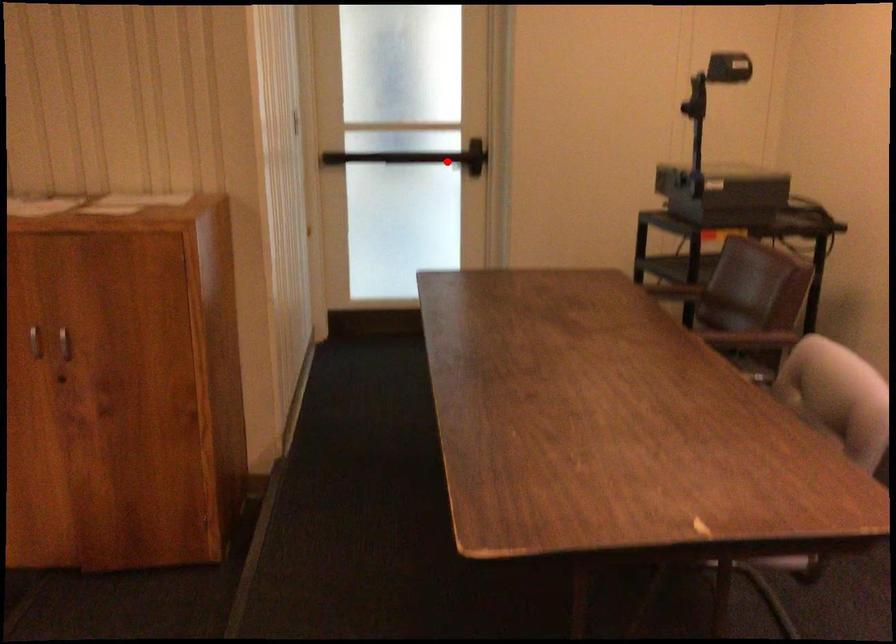
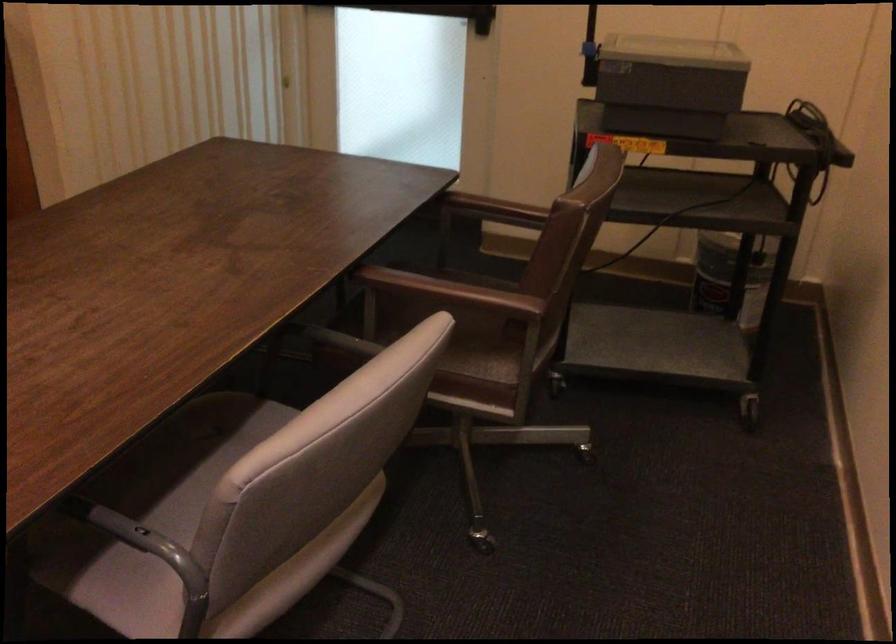
Question: I am providing you with two images of the same scene from different viewpoints. Image1 has a red point marked. In image2, the corresponding 3D location appears at what relative position? Reply with the corresponding letter.

Choices:
 (A) Closer
 (B) Farther

Answer: (A)